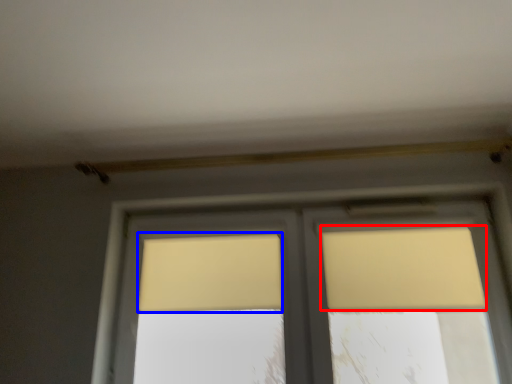
Question: Which point is further to the camera, curtain (highlighted by a red box) or curtain (highlighted by a blue box)?

Choices:
 (A) curtain
 (B) curtain

Answer: (B)